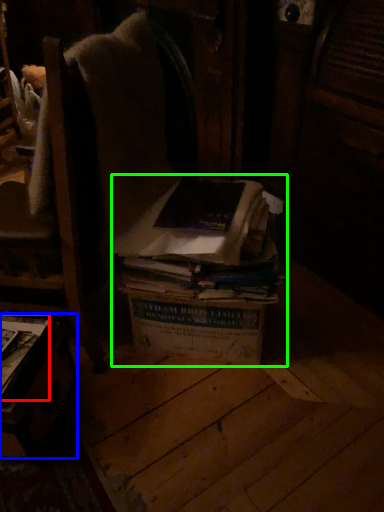
Question: Considering the real-world distances, which object is farthest from book (highlighted by a red box)? table (highlighted by a blue box) or book (highlighted by a green box)?

Choices:
 (A) table
 (B) book

Answer: (B)